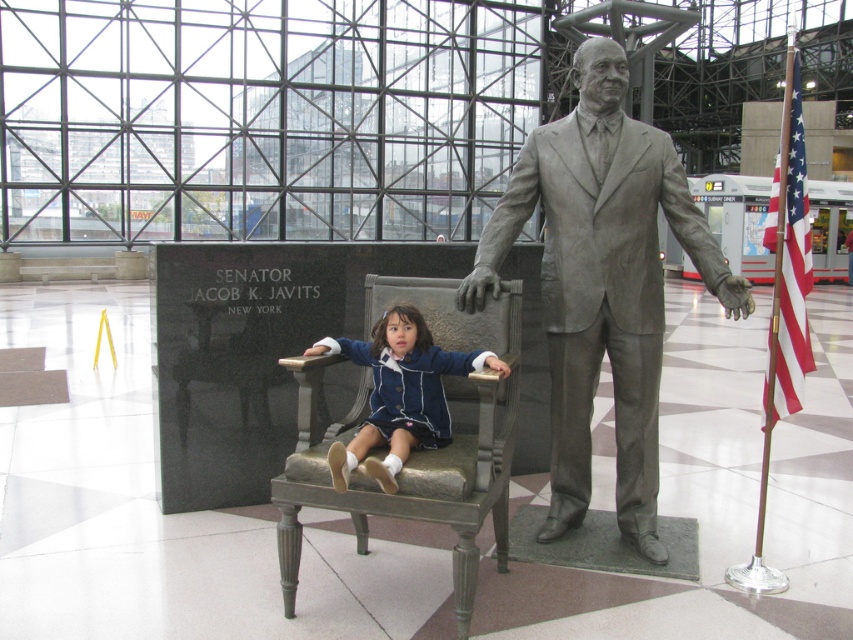
Question: Which object is closer to the camera taking this photo?

Choices:
 (A) blue fabric dress at center
 (B) gray polished statue at center

Answer: (A)

Question: Can you confirm if bronze/golden-brown armchair at center is positioned to the left of blue fabric dress at center?

Choices:
 (A) no
 (B) yes

Answer: (B)

Question: Which of these objects is positioned closest to the bronze/golden-brown armchair at center?

Choices:
 (A) gray polished statue at center
 (B) blue fabric dress at center

Answer: (B)

Question: Is gray polished statue at center wider than bronze/golden-brown armchair at center?

Choices:
 (A) yes
 (B) no

Answer: (A)

Question: Which of these objects is positioned closest to the bronze/golden-brown armchair at center?

Choices:
 (A) blue fabric dress at center
 (B) gray polished statue at center

Answer: (A)

Question: From the image, what is the correct spatial relationship of bronze/golden-brown armchair at center in relation to blue fabric dress at center?

Choices:
 (A) left
 (B) right

Answer: (A)